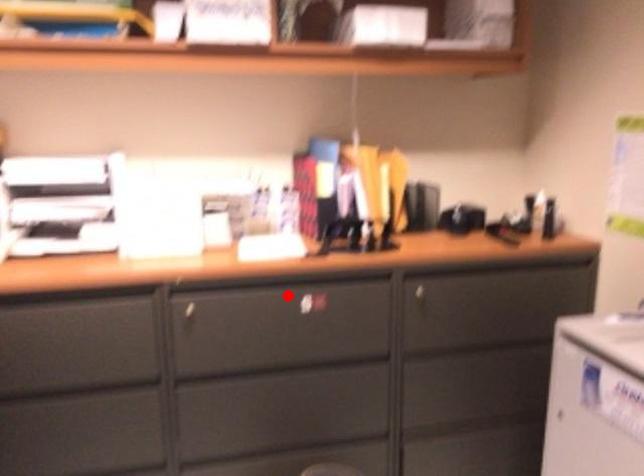
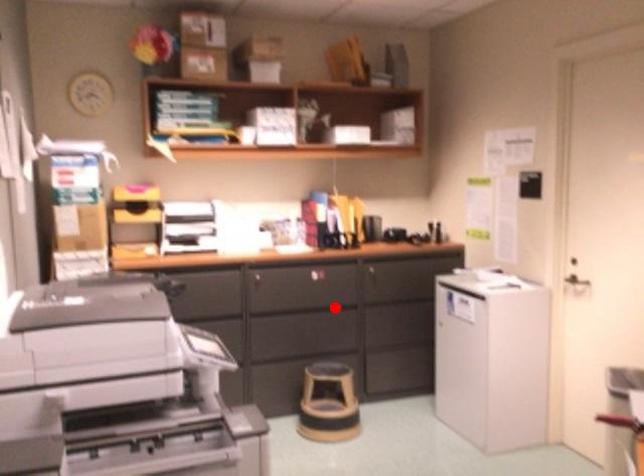
I am providing you with two images of the same scene from different viewpoints. A red point is marked on the first image and another point is marked on the second image. Are the points marked in image1 and image2 representing the same 3D position?

No